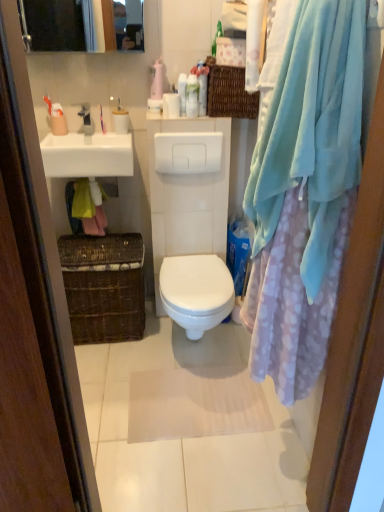
This screenshot has width=384, height=512. What are the coordinates of `vacant space behind white textured bath mat at center` in the screenshot? It's located at (191, 351).